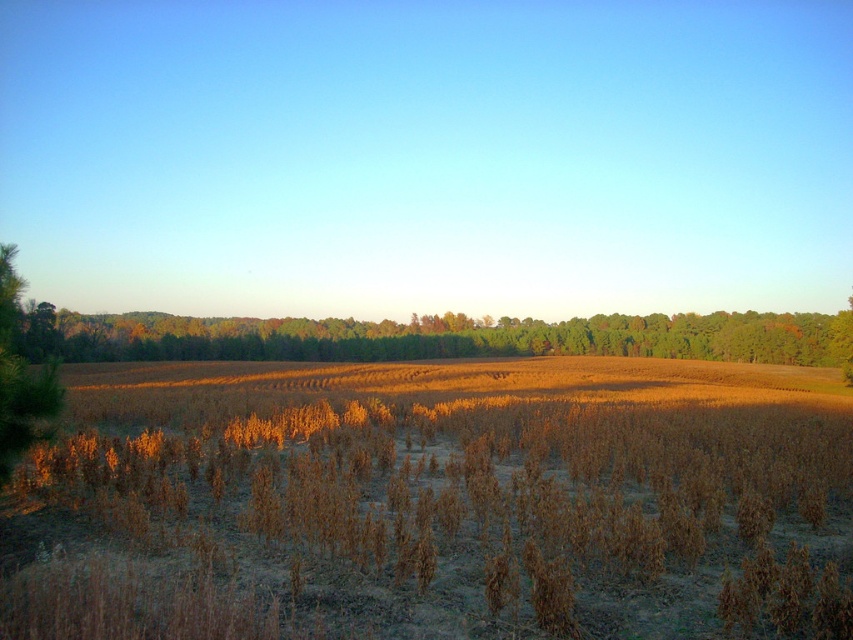
Can you confirm if brown textured field at center is bigger than green matte tree at left?

Indeed, brown textured field at center has a larger size compared to green matte tree at left.

Is point (756, 355) closer to camera compared to point (0, 468)?

That is False.

Is point (300, 330) farther from camera compared to point (56, 404)?

That is True.

Find the location of a particular element. The width and height of the screenshot is (853, 640). brown textured field at center is located at coordinates coord(434,337).

In the scene shown: Measure the distance from brown dry wheat at center to green matte tree at left.

23.71 meters

Based on the photo, does brown dry wheat at center have a larger size compared to green matte tree at left?

Indeed, brown dry wheat at center has a larger size compared to green matte tree at left.

Where is `brown dry wheat at center`? This screenshot has height=640, width=853. brown dry wheat at center is located at coordinates (434, 502).

Is brown dry wheat at center wider than brown textured field at center?

Incorrect, brown dry wheat at center's width does not surpass brown textured field at center's.

Can you confirm if brown dry wheat at center is bigger than brown textured field at center?

Actually, brown dry wheat at center might be smaller than brown textured field at center.

Does point (248, 556) come farther from viewer compared to point (395, 342)?

No, (248, 556) is closer to viewer.

Locate an element on the screen. brown dry wheat at center is located at coordinates (434, 502).